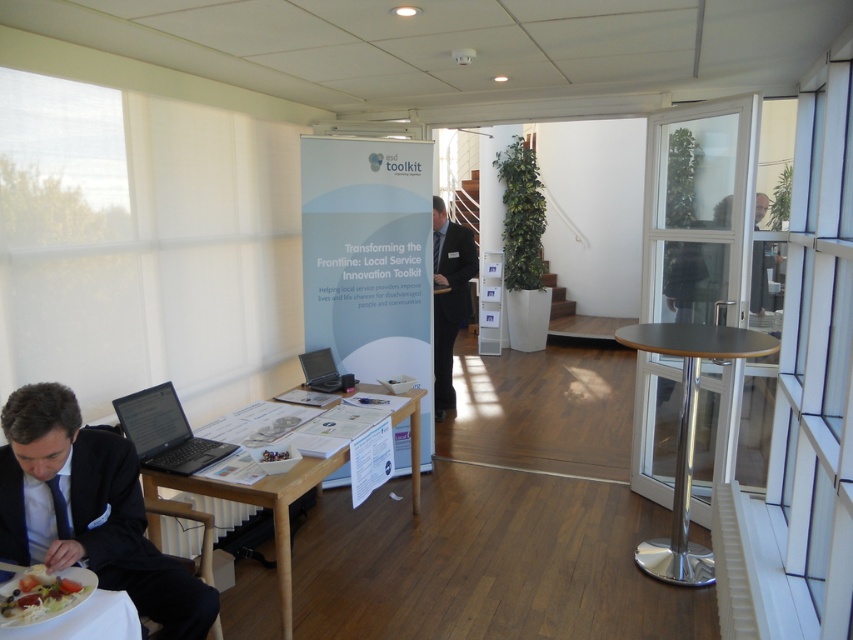
From the picture: Is matte black laptop at lower left to the left of matte black laptop at center from the viewer's perspective?

Indeed, matte black laptop at lower left is positioned on the left side of matte black laptop at center.

Which of these two, matte black laptop at lower left or matte black laptop at center, stands shorter?

matte black laptop at center is shorter.

Is point (122, 403) positioned before point (305, 378)?

Yes, point (122, 403) is closer to viewer.

The height and width of the screenshot is (640, 853). I want to click on matte black laptop at lower left, so click(165, 433).

Is metallic gray table at right taller than light brown wooden table at lower left?

Correct, metallic gray table at right is much taller as light brown wooden table at lower left.

At what (x,y) coordinates should I click in order to perform the action: click on metallic gray table at right. Please return your answer as a coordinate pair (x, y). Looking at the image, I should click on (688, 433).

Describe the element at coordinates (688, 433) in the screenshot. This screenshot has width=853, height=640. I see `metallic gray table at right` at that location.

You are a GUI agent. You are given a task and a screenshot of the screen. Output one action in this format:
    pyautogui.click(x=<x>, y=<y>)
    Task: Click on the metallic gray table at right
    The height and width of the screenshot is (640, 853).
    Given the screenshot: What is the action you would take?
    pyautogui.click(x=688, y=433)

Who is more forward, (285, 492) or (339, 376)?

Point (285, 492)

Does light brown wooden table at lower left have a larger size compared to matte black laptop at center?

Yes.

Is point (277, 531) less distant than point (326, 369)?

That is True.

Where is `light brown wooden table at lower left`? light brown wooden table at lower left is located at coordinates (260, 506).